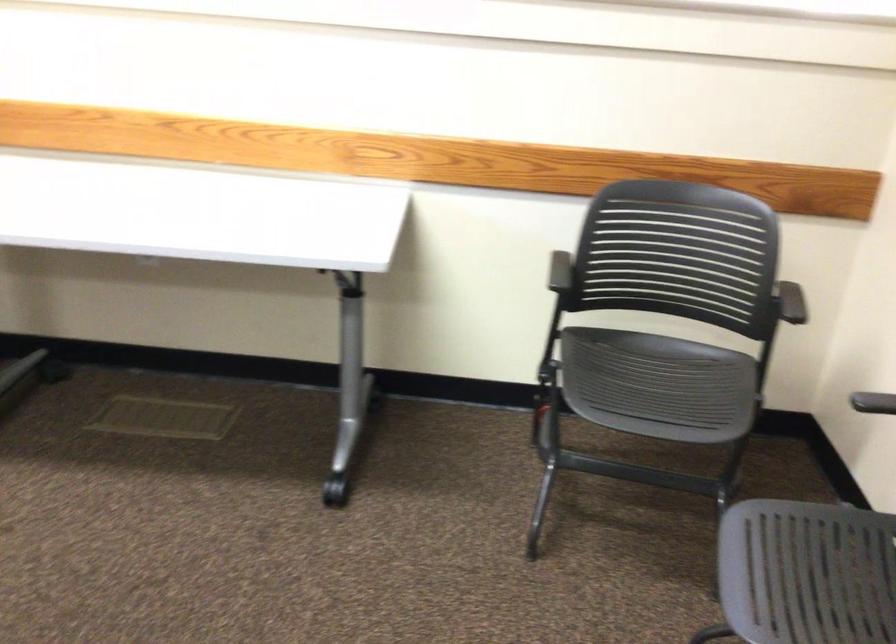
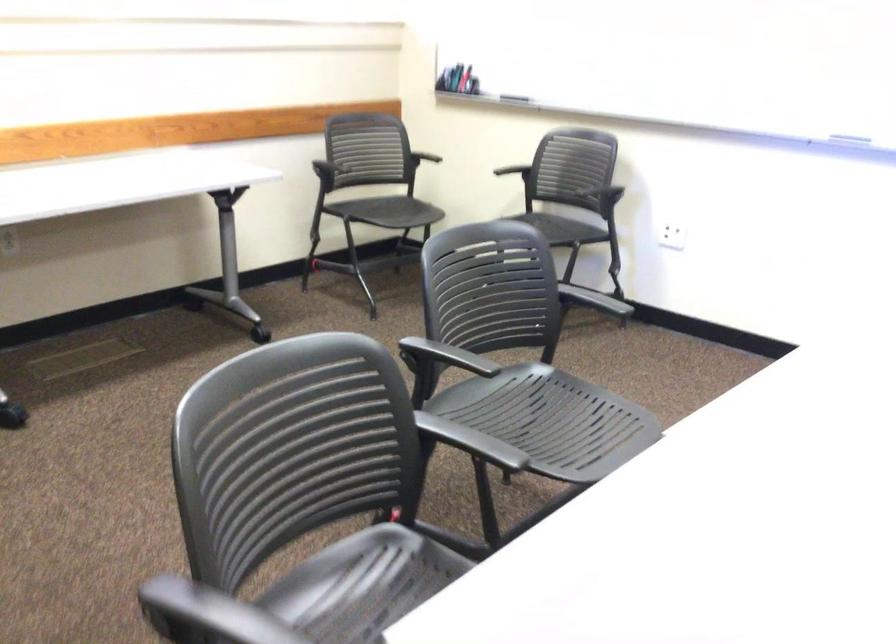
The point at (560, 270) is marked in the first image. Where is the corresponding point in the second image?

(340, 158)